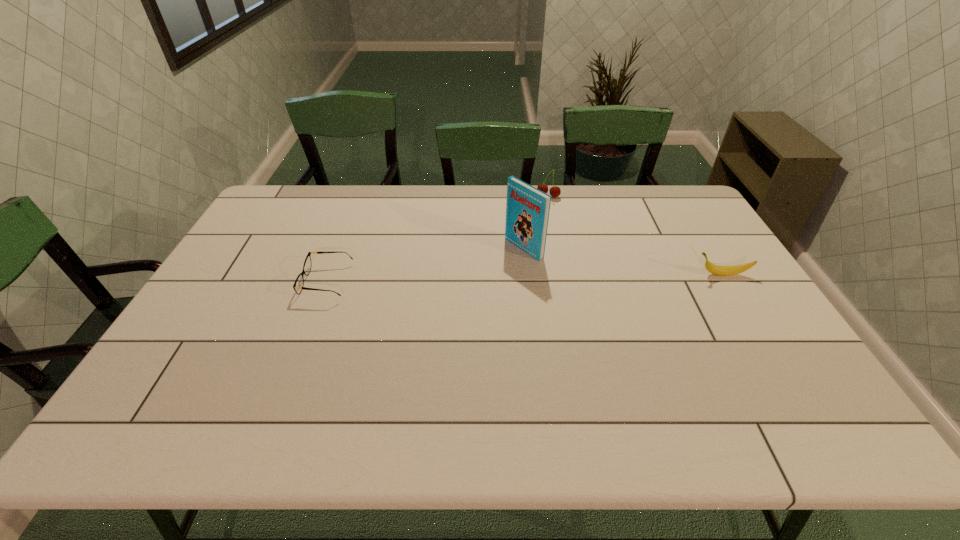
Where is `free space on the desktop that is between the shortest object and the rightmost object and is positioned on the front cover of the second farthest object`? The width and height of the screenshot is (960, 540). free space on the desktop that is between the shortest object and the rightmost object and is positioned on the front cover of the second farthest object is located at coordinates (471, 279).

This screenshot has width=960, height=540. Identify the location of vacant spot on the desktop that is between the shortest object and the third tallest object and is positioned on the surface of the second object from right to left. (486, 279).